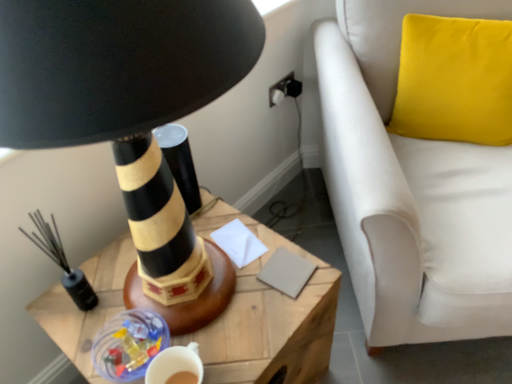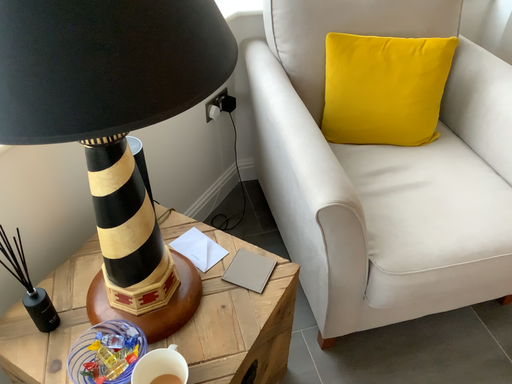
Question: How did the camera likely rotate when shooting the video?

Choices:
 (A) rotated left
 (B) rotated right

Answer: (B)